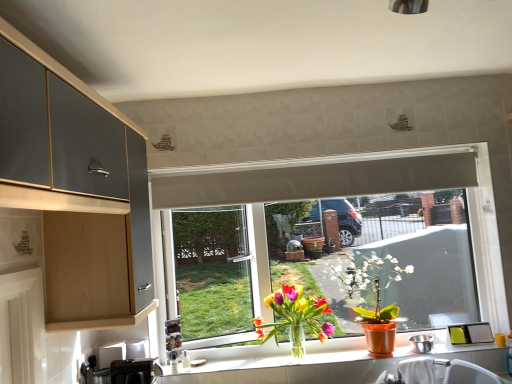
The image size is (512, 384). What are the coordinates of `free point above translucent glass vase at lower center (from a real-world perspective)` in the screenshot? It's located at (373, 357).